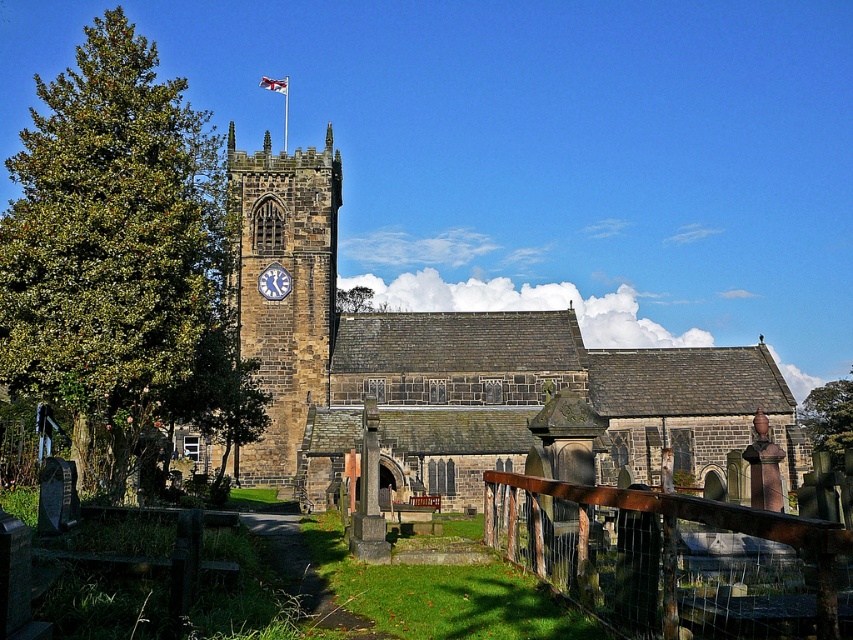
Question: Does brown stone clock tower at center-left appear over blue fabric flag at upper center?

Choices:
 (A) no
 (B) yes

Answer: (A)

Question: From the image, what is the correct spatial relationship of green leafy tree at left in relation to rusty metal fence at lower center?

Choices:
 (A) above
 (B) below

Answer: (A)

Question: Which is farther from the brown stone clock tower at center-left?

Choices:
 (A) rusty metal fence at lower center
 (B) green leafy tree at center
 (C) green leafy tree at left
 (D) brown stone church at center

Answer: (A)

Question: Which of the following is the farthest from the observer?

Choices:
 (A) (370, 289)
 (B) (270, 266)
 (C) (273, 180)

Answer: (A)

Question: Can you confirm if green leafy tree at left is positioned below green leafy tree at center?

Choices:
 (A) no
 (B) yes

Answer: (A)

Question: Which of the following is the farthest from the observer?

Choices:
 (A) blue fabric flag at upper center
 (B) green leafy tree at center
 (C) brown stone clock tower at center-left
 (D) rusty metal fence at lower center

Answer: (B)